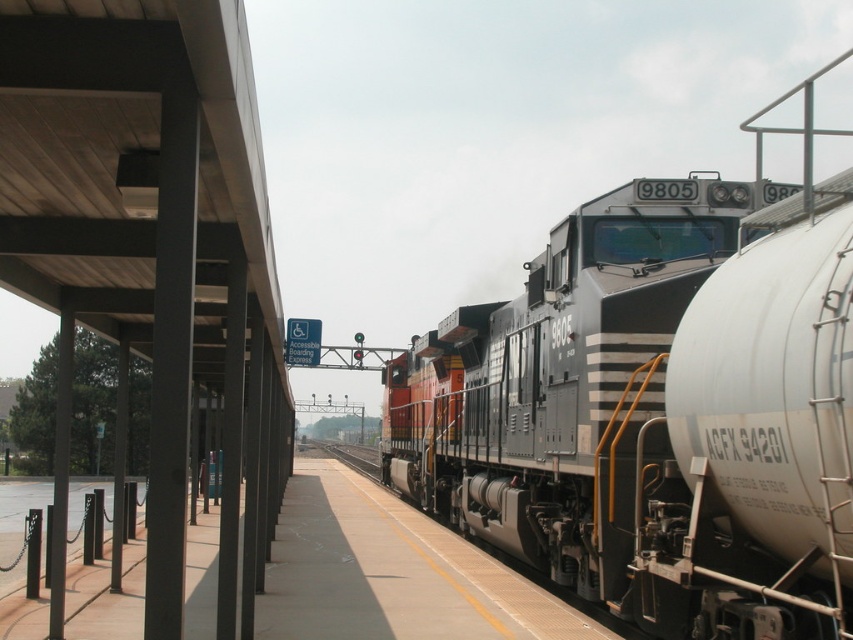
You are a passenger waiting on the concrete platform at center. You want to board the black metal train at center. Is the train big enough to accommodate you?

The black metal train at center has a larger size compared to concrete platform at center, so yes, the train is large enough to accommodate you.

You are standing on the concrete platform at center and want to walk to the black metal train track at center. Is the path directly between them clear of any obstacles?

The concrete platform at center is in front of black metal train track at center, so the path between them is blocked by the platform itself. You cannot walk directly between them without going around the platform.

You are standing at the point closest to the train in the image. Which of the two points, point (379, 493) or point (322, 449), is closer to you?

Point (379, 493) is in front of point (322, 449), so it is closer to you.